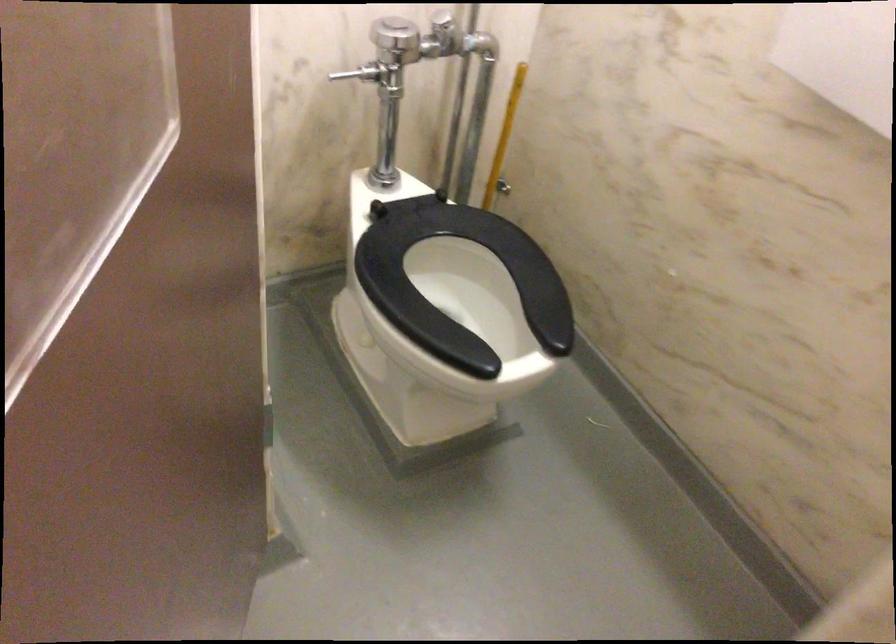
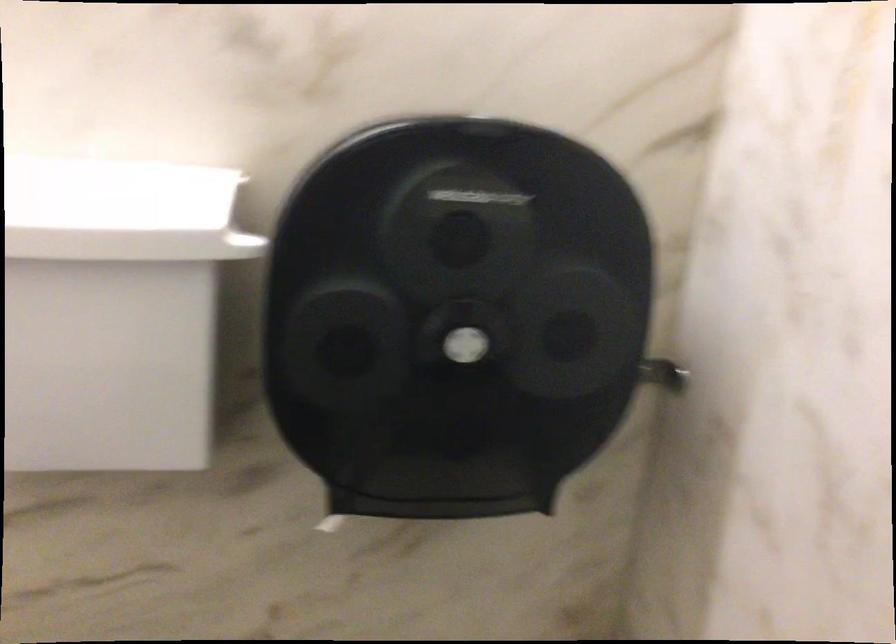
Question: The first image is from the beginning of the video and the second image is from the end. How did the camera likely rotate when shooting the video?

Choices:
 (A) Left
 (B) Right
 (C) Up
 (D) Down

Answer: (B)